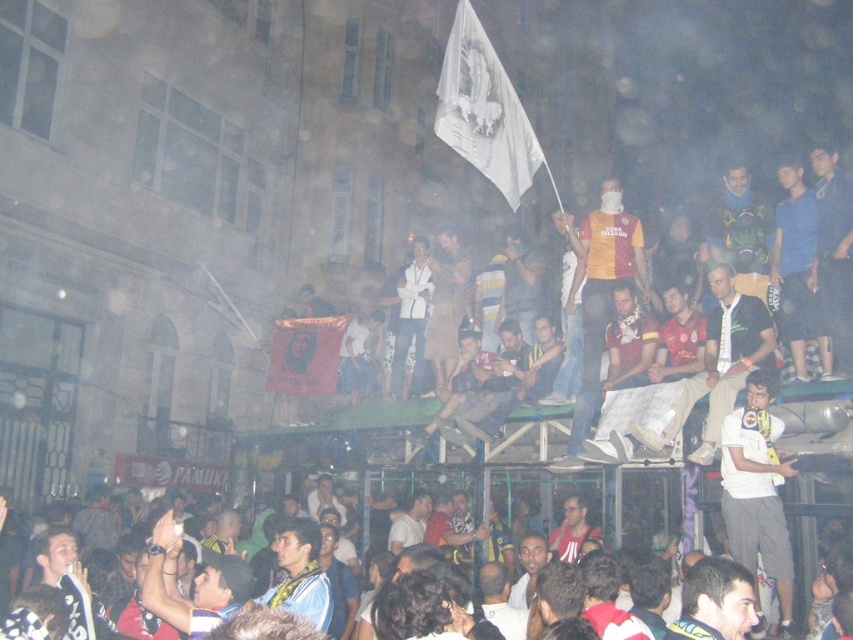
Question: Can you confirm if white fabric flag at upper center is positioned above dark blue shirt at center?

Choices:
 (A) no
 (B) yes

Answer: (B)

Question: Which is farther from the blue fabric shirt at upper right?

Choices:
 (A) red fabric banner at center
 (B) white cotton shirt at lower center
 (C) yellow jersey at center

Answer: (A)

Question: Which point appears closest to the camera in this image?

Choices:
 (A) (337, 346)
 (B) (621, 273)

Answer: (B)

Question: From the image, what is the correct spatial relationship of white cotton shirt at lower center in relation to dark blue shirt at center?

Choices:
 (A) above
 (B) below

Answer: (B)

Question: Among these objects, which one is nearest to the camera?

Choices:
 (A) red fabric banner at center
 (B) dark blue shirt at center
 (C) white fabric flag at upper center
 (D) blue fabric shirt at upper right

Answer: (B)

Question: From the image, what is the correct spatial relationship of white fabric flag at upper center in relation to yellow jersey at center?

Choices:
 (A) above
 (B) below

Answer: (A)